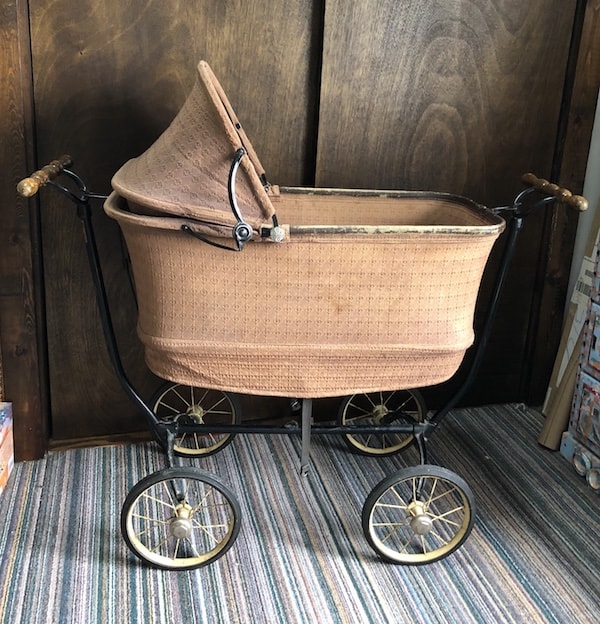
The width and height of the screenshot is (600, 624). Find the location of `door`. door is located at coordinates (380, 104).